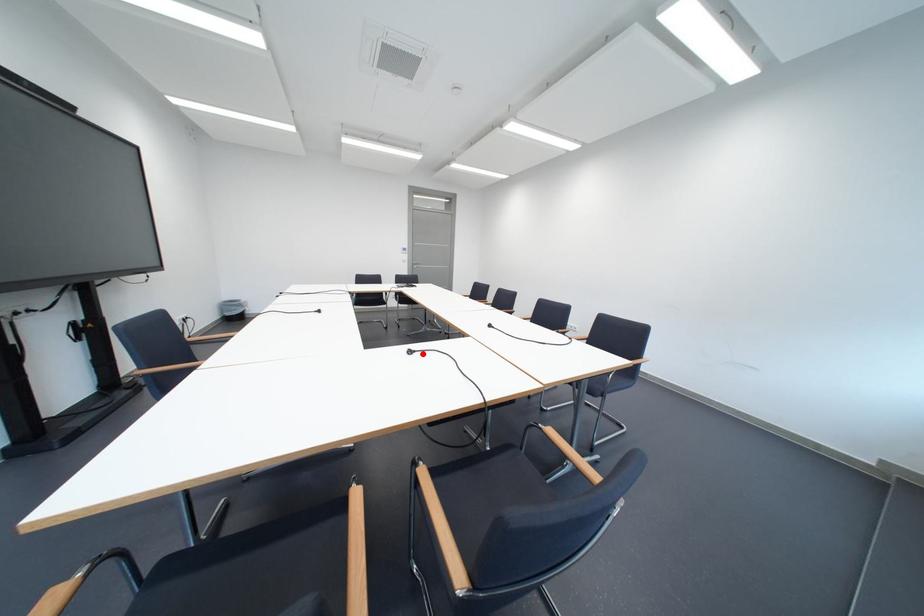
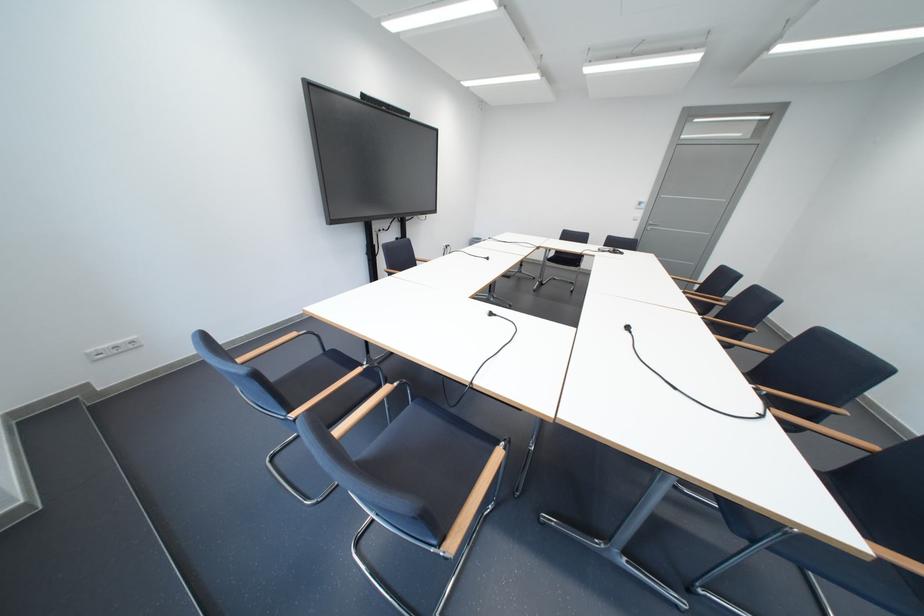
Find the pixel in the second image that matches the highlighted location in the first image.

(503, 315)